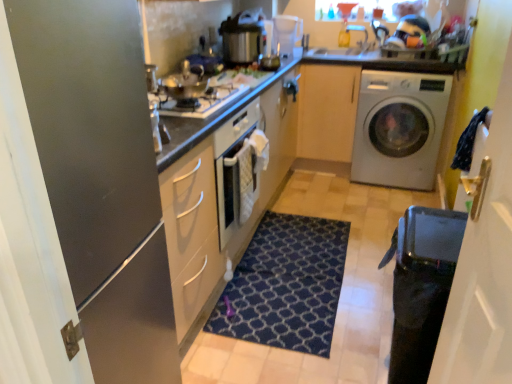
Question: Could you tell me if light wood cabinet at center is turned towards satin silver gas stove at center?

Choices:
 (A) no
 (B) yes

Answer: (B)

Question: Is light wood cabinet at center not inside satin silver gas stove at center?

Choices:
 (A) yes
 (B) no

Answer: (A)

Question: From a real-world perspective, is light wood cabinet at center positioned under satin silver gas stove at center based on gravity?

Choices:
 (A) yes
 (B) no

Answer: (A)

Question: Are light wood cabinet at center and satin silver gas stove at center far apart?

Choices:
 (A) no
 (B) yes

Answer: (B)

Question: Does light wood cabinet at center appear on the right side of satin silver gas stove at center?

Choices:
 (A) no
 (B) yes

Answer: (B)

Question: From the image's perspective, is light wood cabinet at center over satin silver gas stove at center?

Choices:
 (A) no
 (B) yes

Answer: (B)

Question: Can you confirm if white glossy countertop at upper center is shorter than dark blue textured rug at center?

Choices:
 (A) yes
 (B) no

Answer: (B)

Question: Can you confirm if white glossy countertop at upper center is positioned to the right of dark blue textured rug at center?

Choices:
 (A) yes
 (B) no

Answer: (A)

Question: From a real-world perspective, is white glossy countertop at upper center physically above dark blue textured rug at center?

Choices:
 (A) no
 (B) yes

Answer: (B)

Question: Is white glossy countertop at upper center thinner than dark blue textured rug at center?

Choices:
 (A) no
 (B) yes

Answer: (B)

Question: Is white glossy countertop at upper center facing towards dark blue textured rug at center?

Choices:
 (A) yes
 (B) no

Answer: (B)

Question: From the image's perspective, would you say white glossy countertop at upper center is shown under dark blue textured rug at center?

Choices:
 (A) no
 (B) yes

Answer: (A)

Question: Is transparent glass door at right, the 2th glass door in the left-to-right sequence, further to the viewer compared to transparent plastic coffee machine at upper center?

Choices:
 (A) yes
 (B) no

Answer: (B)